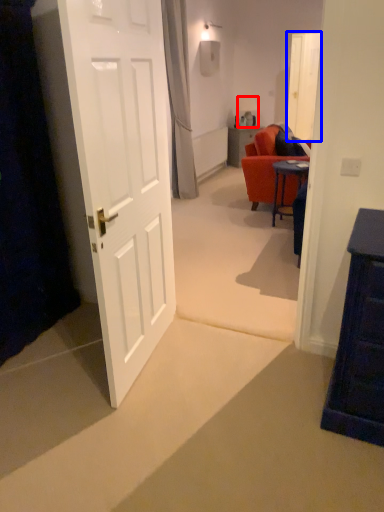
Question: Among these objects, which one is farthest to the camera, lamp (highlighted by a red box) or glass door (highlighted by a blue box)?

Choices:
 (A) lamp
 (B) glass door

Answer: (A)